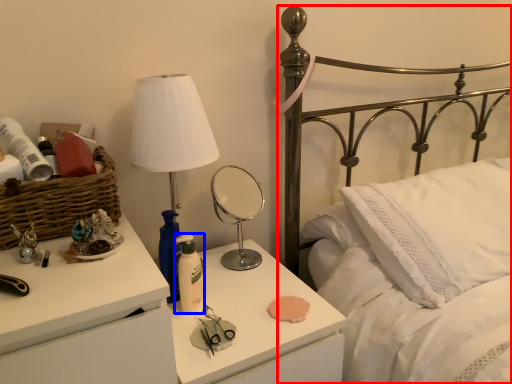
Question: Which object appears farthest to the camera in this image, bed (highlighted by a red box) or bottle (highlighted by a blue box)?

Choices:
 (A) bed
 (B) bottle

Answer: (B)